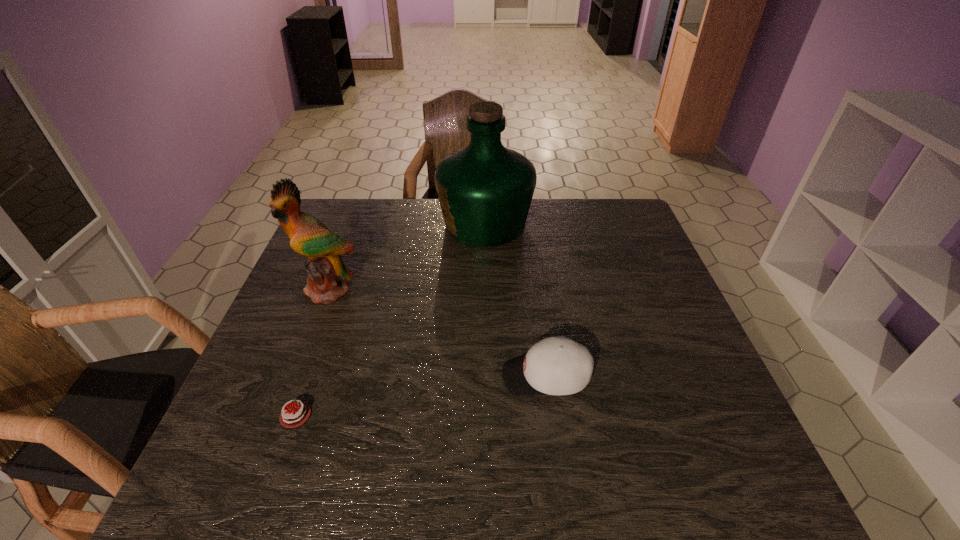
The image size is (960, 540). Find the location of `the farthest object`. the farthest object is located at coordinates (485, 190).

Locate an element on the screen. The width and height of the screenshot is (960, 540). parrot is located at coordinates (327, 274).

Identify the location of the second shortest object. (557, 365).

The image size is (960, 540). Identify the location of the shortest object. (294, 416).

Identify the location of vacant space situated 0.150m on the label side of the farthest object. This screenshot has height=540, width=960. (391, 224).

Locate an element on the screen. This screenshot has width=960, height=540. vacant space located on the label side of the farthest object is located at coordinates (319, 224).

You are a GUI agent. You are given a task and a screenshot of the screen. Output one action in this format:
    pyautogui.click(x=<x>, y=<y>)
    Task: Click on the vacant area situated on the label side of the farthest object
    The height and width of the screenshot is (540, 960).
    Given the screenshot: What is the action you would take?
    click(x=328, y=224)

You are a GUI agent. You are given a task and a screenshot of the screen. Output one action in this format:
    pyautogui.click(x=<x>, y=<y>)
    Task: Click on the free location located 0.250m on the front-facing side of the third nearest object
    
    Given the screenshot: What is the action you would take?
    (x=290, y=390)

Locate an element on the screen. vacant point located 0.280m on the front-facing side of the baseball cap is located at coordinates (374, 376).

In order to click on free location located 0.290m on the front-facing side of the baseball cap in this screenshot , I will do pos(370,376).